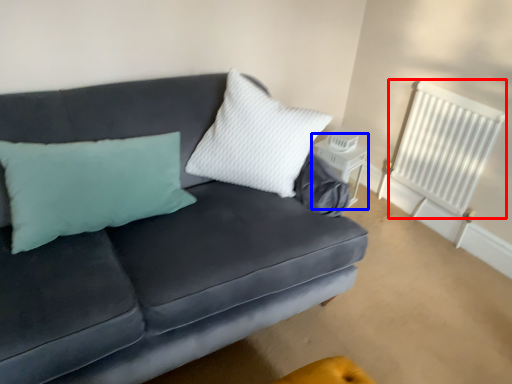
Question: Which object appears farthest to the camera in this image, radiator (highlighted by a red box) or table (highlighted by a blue box)?

Choices:
 (A) radiator
 (B) table

Answer: (B)